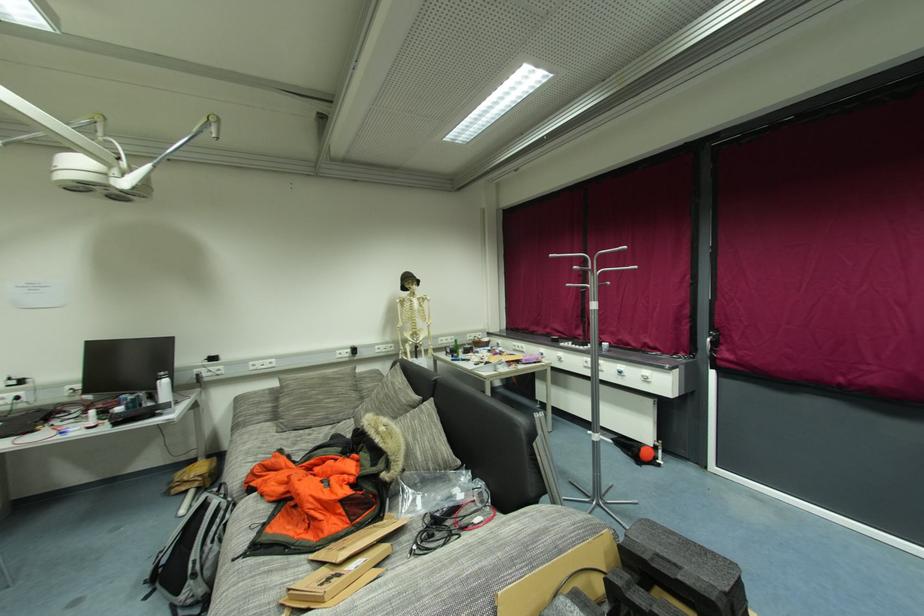
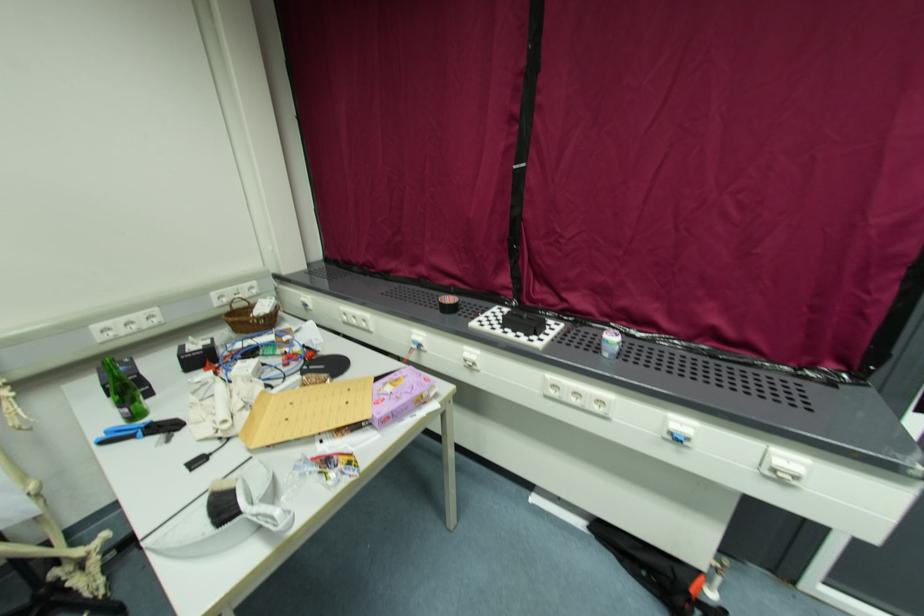
In the second image, find the point that corresponds to [456,361] in the first image.

(107, 443)